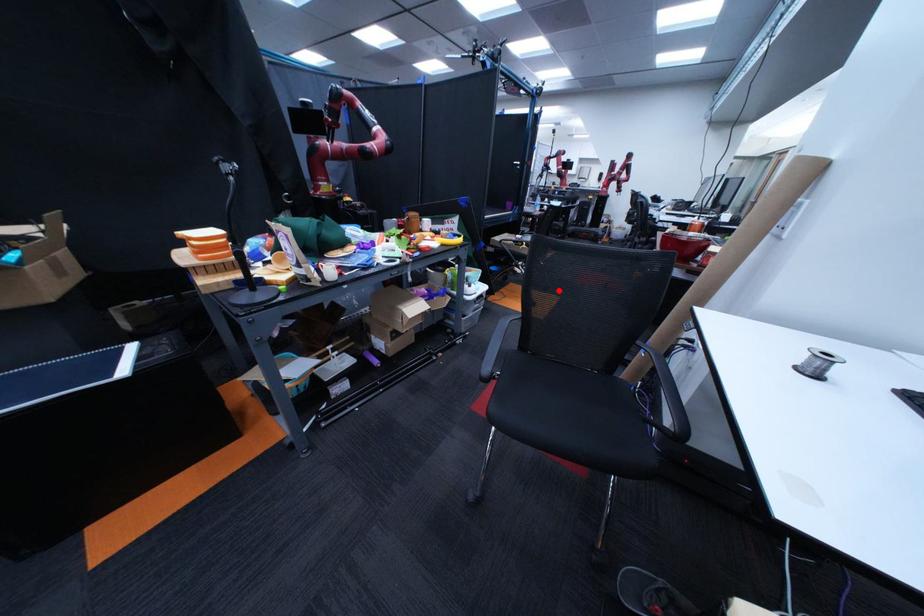
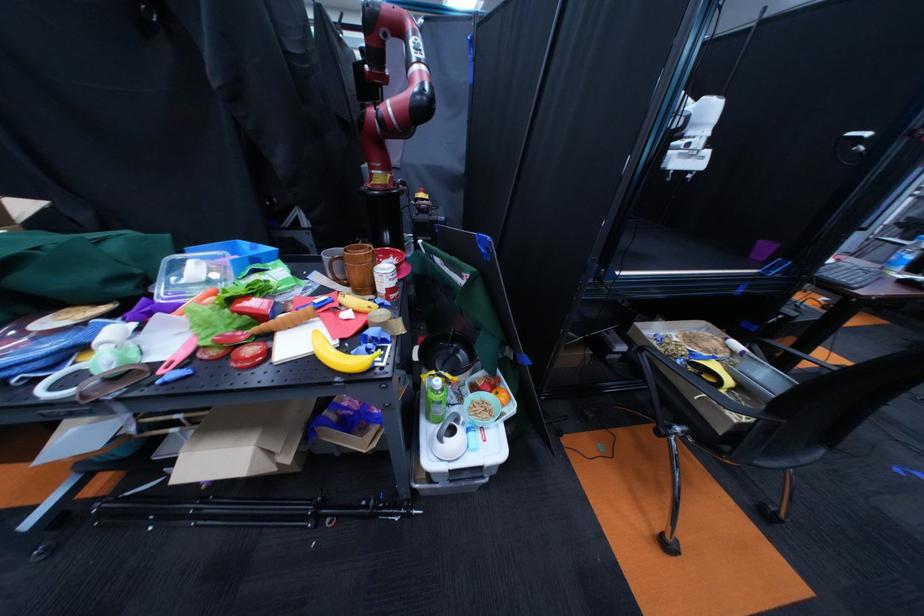
Question: A red point is marked in image1. In image2, is the corresponding 3D point closer to the camera or farther? Reply with the corresponding letter.

Choices:
 (A) The corresponding 3D point is closer.
 (B) The corresponding 3D point is farther.

Answer: (A)